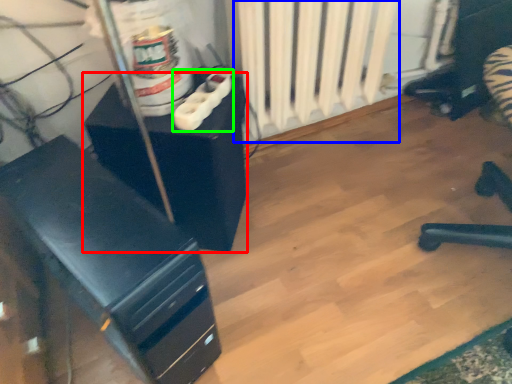
Question: Which is farther away from furniture (highlighted by a red box)? radiator (highlighted by a blue box) or plug (highlighted by a green box)?

Choices:
 (A) radiator
 (B) plug

Answer: (A)